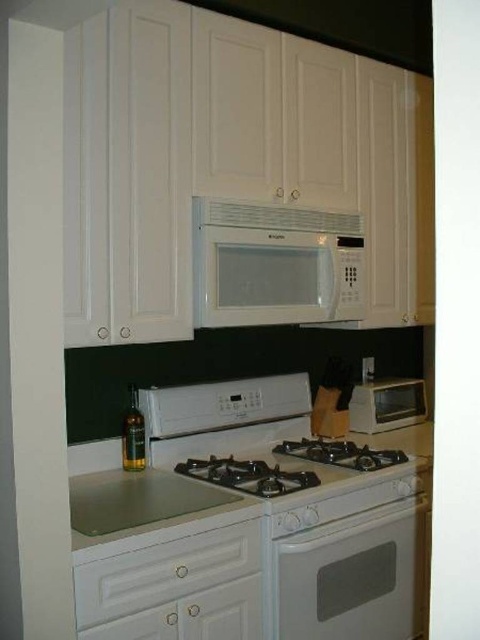
You are preparing to place a large pot on the counter between the transparent glass sink at center and the white plastic toaster oven at center. Which appliance should you move to make space?

The transparent glass sink at center is smaller than the white plastic toaster oven at center, so you should move the white plastic toaster oven at center to make space for the large pot.

You are trying to place a new appliance on the kitchen counter. The white plastic toaster oven at center is currently occupying space. If you want to replace it with a larger appliance, would the white textured exhaust hood at upper center fit in its place?

The white textured exhaust hood at upper center is wider than the white plastic toaster oven at center, so it may not fit in the space currently occupied by the toaster oven unless there is additional room available.

You are standing in the kitchen and want to place a small bowl between the two points labeled point [110,440] and point [338,451]. Based on their positions, which point should the bowl be closer to in order to be placed in front of the other?

The bowl should be placed closer to point [110,440] because it is in front of point [338,451].